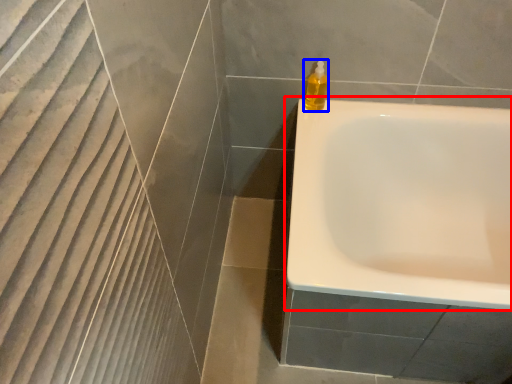
Question: Which of the following is the closest to the observer, bathtub (highlighted by a red box) or soap dispenser (highlighted by a blue box)?

Choices:
 (A) bathtub
 (B) soap dispenser

Answer: (A)